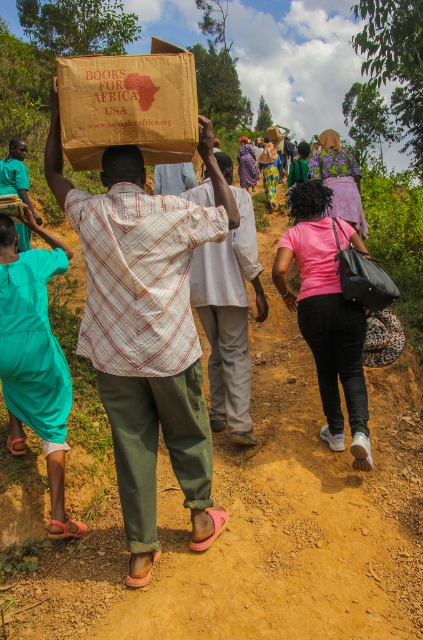
Can you confirm if brown dirt track at center is positioned to the right of matte brown paper bag at center?

No, brown dirt track at center is not to the right of matte brown paper bag at center.

Describe the element at coordinates (227, 508) in the screenshot. Image resolution: width=423 pixels, height=640 pixels. I see `brown dirt track at center` at that location.

Where is `brown dirt track at center`? The image size is (423, 640). brown dirt track at center is located at coordinates (227, 508).

Is plaid fabric shirt at center bigger than matte brown cardboard at center?

Yes.

Between point (244, 193) and point (114, 179), which one is positioned behind?

The point (244, 193) is more distant.

Does point (217, 353) come in front of point (106, 184)?

No, it is not.

You are a GUI agent. You are given a task and a screenshot of the screen. Output one action in this format:
    pyautogui.click(x=<x>, y=<y>)
    Task: Click on the plaid fabric shirt at center
    The image size is (423, 640).
    Given the screenshot: What is the action you would take?
    pyautogui.click(x=228, y=317)

Who is more forward, (123, 163) or (299, 147)?

Point (123, 163)

Who is higher up, matte brown cardboard at center or smooth brown hair at center?

smooth brown hair at center is above.

Is point (129, 177) closer to viewer compared to point (302, 145)?

That is True.

Find the location of a particular element. The height and width of the screenshot is (640, 423). matte brown cardboard at center is located at coordinates (123, 164).